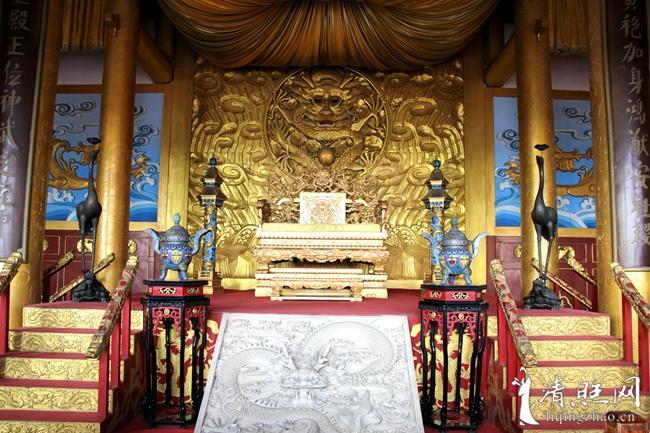
The height and width of the screenshot is (433, 650). In order to click on pot in this screenshot , I will do (452, 254), (172, 248).